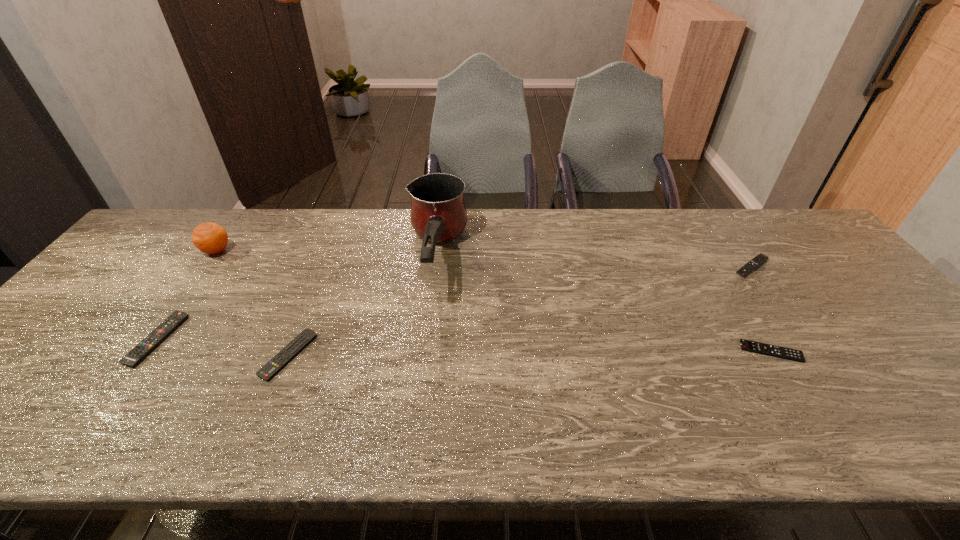
In order to click on remote control identified as the closest to the shortest object in this screenshot , I will do `click(760, 258)`.

Locate which remote control ranks second in proximity to the orange. Please provide its 2D coordinates. Your answer should be formatted as a tuple, i.e. [(x, y)], where the tuple contains the x and y coordinates of a point satisfying the conditions above.

[(289, 352)]

Locate an element on the screen. blank area in the image that satisfies the following two spatial constraints: 1. on the handle side of the tallest object; 2. on the left side of the farthest remote control is located at coordinates (435, 267).

Find the location of `free space in the image that satisfies the following two spatial constraints: 1. on the handle side of the farthest remote control; 2. on the left side of the tallest object`. free space in the image that satisfies the following two spatial constraints: 1. on the handle side of the farthest remote control; 2. on the left side of the tallest object is located at coordinates (435, 267).

Locate an element on the screen. This screenshot has width=960, height=540. free space that satisfies the following two spatial constraints: 1. on the front side of the second tallest object; 2. on the left side of the farthest remote control is located at coordinates (205, 267).